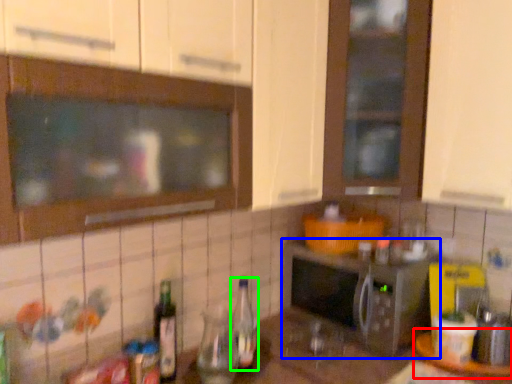
Question: Based on their relative distances, which object is nearer to table (highlighted by a red box)? Choose from microwave oven (highlighted by a blue box) and bottle (highlighted by a green box).

Choices:
 (A) microwave oven
 (B) bottle

Answer: (A)